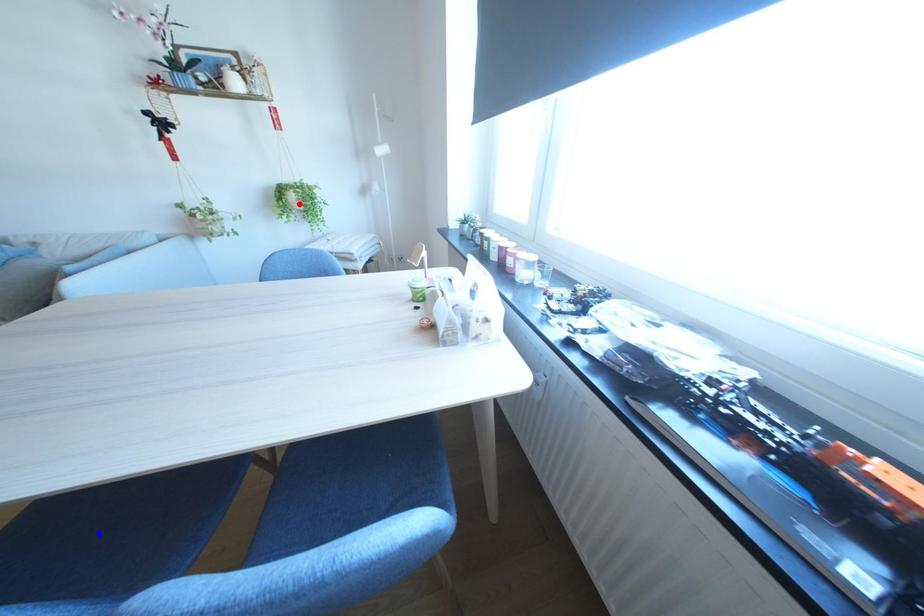
Question: In the image, two points are highlighted. Which point is nearer to the camera? Reply with the corresponding letter.

Choices:
 (A) blue point
 (B) red point

Answer: (A)